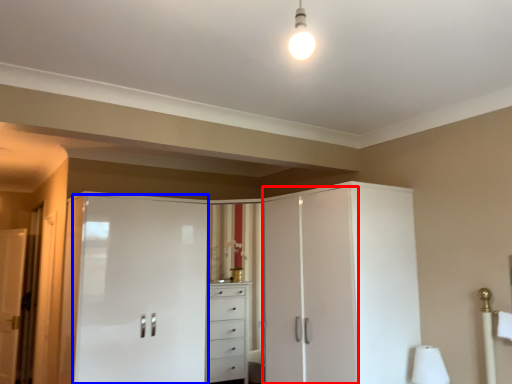
Question: Which of the following is the closest to the observer, screen door (highlighted by a red box) or screen door (highlighted by a blue box)?

Choices:
 (A) screen door
 (B) screen door

Answer: (A)